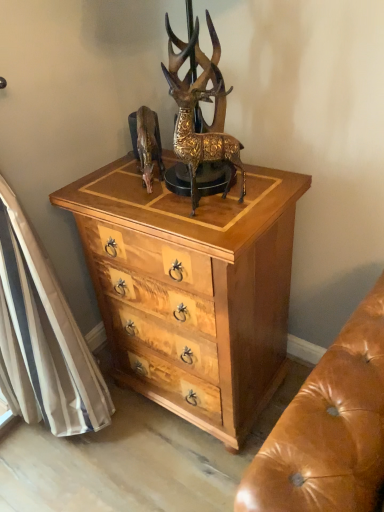
The height and width of the screenshot is (512, 384). Find the location of `free spot to the right of gold textured deer at center`. free spot to the right of gold textured deer at center is located at coordinates [263, 196].